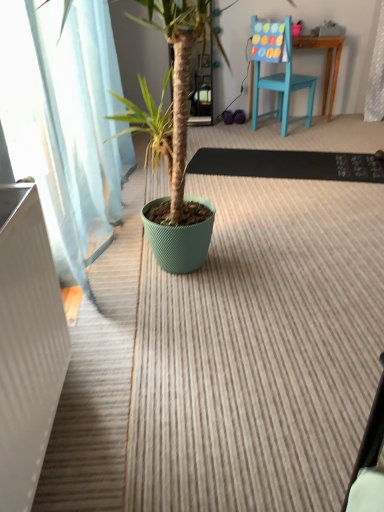
Where is `white ribbed radiator at left`? This screenshot has width=384, height=512. white ribbed radiator at left is located at coordinates (27, 344).

Find the location of a particular element. teal wooden chair at upper right is located at coordinates (283, 88).

Describe the element at coordinates (288, 165) in the screenshot. I see `black rubber doormat at center, positioned as the first doormat in top-to-bottom order` at that location.

The image size is (384, 512). In order to click on white ribbed radiator at left in this screenshot , I will do `click(27, 344)`.

Is point (283, 133) positioned in front of point (295, 170)?

No, (283, 133) is further to viewer.

In the image, is teal wooden chair at upper right positioned in front of or behind black rubber doormat at center, positioned as the first doormat in top-to-bottom order?

In the image, teal wooden chair at upper right appears behind black rubber doormat at center, positioned as the first doormat in top-to-bottom order.

Which of these two, teal wooden chair at upper right or black rubber doormat at center, positioned as the first doormat in top-to-bottom order, is bigger?

Bigger between the two is teal wooden chair at upper right.

From a real-world perspective, relative to black rubber doormat at center, the 2th doormat positioned from the bottom, is teal wooden chair at upper right vertically above or below?

teal wooden chair at upper right is above black rubber doormat at center, the 2th doormat positioned from the bottom.

Would you say black rubber doormat at center, positioned as the first doormat in top-to-bottom order, is inside or outside teal wooden chair at upper right?

The correct answer is: outside.

Which is more to the right, black rubber doormat at center, the 2th doormat positioned from the bottom, or teal wooden chair at upper right?

From the viewer's perspective, teal wooden chair at upper right appears more on the right side.

Is black rubber doormat at center, the 2th doormat positioned from the bottom, shorter than teal wooden chair at upper right?

Indeed, black rubber doormat at center, the 2th doormat positioned from the bottom, has a lesser height compared to teal wooden chair at upper right.

Is black rubber doormat at center, the 2th doormat positioned from the bottom, facing away from teal wooden chair at upper right?

No, black rubber doormat at center, the 2th doormat positioned from the bottom, is not facing away from teal wooden chair at upper right.

Consider the image. Is teal wooden chair at upper right completely or partially outside of white ribbed radiator at left?

Indeed, teal wooden chair at upper right is completely outside white ribbed radiator at left.

From the image's perspective, which one is positioned lower, teal wooden chair at upper right or white ribbed radiator at left?

white ribbed radiator at left appears lower in the image.

Is teal wooden chair at upper right wider than white ribbed radiator at left?

Yes, teal wooden chair at upper right is wider than white ribbed radiator at left.

Does teal wooden chair at upper right come behind white ribbed radiator at left?

That is True.

Measure the distance between black rubber doormat at center, positioned as the first doormat in top-to-bottom order, and white ribbed radiator at left.

A distance of 7.33 feet exists between black rubber doormat at center, positioned as the first doormat in top-to-bottom order, and white ribbed radiator at left.

Would you say black rubber doormat at center, the 2th doormat positioned from the bottom, is inside or outside white ribbed radiator at left?

The correct answer is: outside.

Does black rubber doormat at center, the 2th doormat positioned from the bottom, have a greater height compared to white ribbed radiator at left?

No, black rubber doormat at center, the 2th doormat positioned from the bottom, is not taller than white ribbed radiator at left.

Is black rubber doormat at center, positioned as the first doormat in top-to-bottom order, at the right side of white ribbed radiator at left?

Correct, you'll find black rubber doormat at center, positioned as the first doormat in top-to-bottom order, to the right of white ribbed radiator at left.

Does teal wooden chair at upper right have a lesser width compared to rug at center, the 2th doormat positioned from the top?

Indeed, teal wooden chair at upper right has a lesser width compared to rug at center, the 2th doormat positioned from the top.

Does teal wooden chair at upper right come behind rug at center, the 2th doormat positioned from the top?

Yes, teal wooden chair at upper right is behind rug at center, the 2th doormat positioned from the top.

Does point (256, 18) come behind point (204, 314)?

Yes, it is behind point (204, 314).

Considering the positions of objects white ribbed radiator at left and rug at center, the first doormat in the bottom-to-top sequence, in the image provided, who is more to the left, white ribbed radiator at left or rug at center, the first doormat in the bottom-to-top sequence,?

From the viewer's perspective, white ribbed radiator at left appears more on the left side.

Consider the image. From a real-world perspective, is white ribbed radiator at left physically located above or below rug at center, the 2th doormat positioned from the top?

Clearly, from a real-world perspective, white ribbed radiator at left is above rug at center, the 2th doormat positioned from the top.

Is point (27, 380) positioned in front of point (285, 260)?

Yes, point (27, 380) is in front of point (285, 260).

Which of these two, white ribbed radiator at left or rug at center, the first doormat in the bottom-to-top sequence, stands shorter?

With less height is rug at center, the first doormat in the bottom-to-top sequence.

Which object is positioned more to the left, rug at center, the first doormat in the bottom-to-top sequence, or black rubber doormat at center, positioned as the first doormat in top-to-bottom order?

black rubber doormat at center, positioned as the first doormat in top-to-bottom order, is more to the left.

Image resolution: width=384 pixels, height=512 pixels. Identify the location of doormat behind the rug at center, the first doormat in the bottom-to-top sequence. coord(288,165).

From a real-world perspective, is rug at center, the first doormat in the bottom-to-top sequence, physically located above or below black rubber doormat at center, the 2th doormat positioned from the bottom?

rug at center, the first doormat in the bottom-to-top sequence, is below black rubber doormat at center, the 2th doormat positioned from the bottom.

Which is closer, (257,300) or (239,160)?

The point (257,300) is more forward.

This screenshot has height=512, width=384. Identify the location of chair on the right of black rubber doormat at center, positioned as the first doormat in top-to-bottom order. (283, 88).

From a real-world perspective, which doormat is the 1st one underneath the teal wooden chair at upper right? Please provide its 2D coordinates.

[(288, 165)]

Looking at the image, which one is located further to rug at center, the 2th doormat positioned from the top, black rubber doormat at center, positioned as the first doormat in top-to-bottom order, or white ribbed radiator at left?

Among the two, black rubber doormat at center, positioned as the first doormat in top-to-bottom order, is located further to rug at center, the 2th doormat positioned from the top.

Based on their spatial positions, is black rubber doormat at center, the 2th doormat positioned from the bottom, or teal wooden chair at upper right further from rug at center, the 2th doormat positioned from the top?

teal wooden chair at upper right.

From the image, which object appears to be farther from rug at center, the first doormat in the bottom-to-top sequence, teal wooden chair at upper right or black rubber doormat at center, positioned as the first doormat in top-to-bottom order?

Among the two, teal wooden chair at upper right is located further to rug at center, the first doormat in the bottom-to-top sequence.

When comparing their distances from black rubber doormat at center, the 2th doormat positioned from the bottom, does teal wooden chair at upper right or white ribbed radiator at left seem further?

white ribbed radiator at left is further to black rubber doormat at center, the 2th doormat positioned from the bottom.

Looking at the image, which one is located further to black rubber doormat at center, the 2th doormat positioned from the bottom, white ribbed radiator at left or rug at center, the first doormat in the bottom-to-top sequence?

white ribbed radiator at left is further to black rubber doormat at center, the 2th doormat positioned from the bottom.

From the image, which object appears to be nearer to black rubber doormat at center, positioned as the first doormat in top-to-bottom order, rug at center, the first doormat in the bottom-to-top sequence, or teal wooden chair at upper right?

teal wooden chair at upper right is closer to black rubber doormat at center, positioned as the first doormat in top-to-bottom order.

Estimate the real-world distances between objects in this image. Which object is further from black rubber doormat at center, positioned as the first doormat in top-to-bottom order, white ribbed radiator at left or teal wooden chair at upper right?

The object further to black rubber doormat at center, positioned as the first doormat in top-to-bottom order, is white ribbed radiator at left.

From the image, which object appears to be farther from rug at center, the first doormat in the bottom-to-top sequence, teal wooden chair at upper right or white ribbed radiator at left?

Based on the image, teal wooden chair at upper right appears to be further to rug at center, the first doormat in the bottom-to-top sequence.

Where is `doormat located between white ribbed radiator at left and black rubber doormat at center, positioned as the first doormat in top-to-bottom order, in the depth direction`? The image size is (384, 512). doormat located between white ribbed radiator at left and black rubber doormat at center, positioned as the first doormat in top-to-bottom order, in the depth direction is located at coordinates (260, 352).

Where is `doormat between rug at center, the 2th doormat positioned from the top, and teal wooden chair at upper right from front to back`? The image size is (384, 512). doormat between rug at center, the 2th doormat positioned from the top, and teal wooden chair at upper right from front to back is located at coordinates (288, 165).